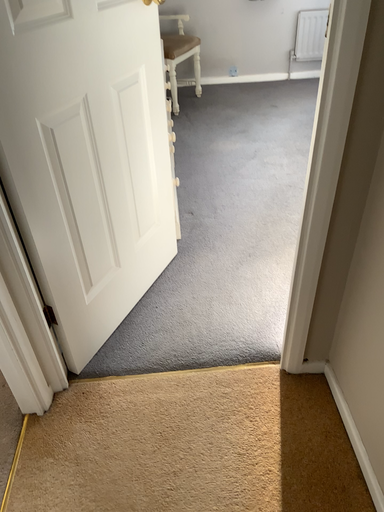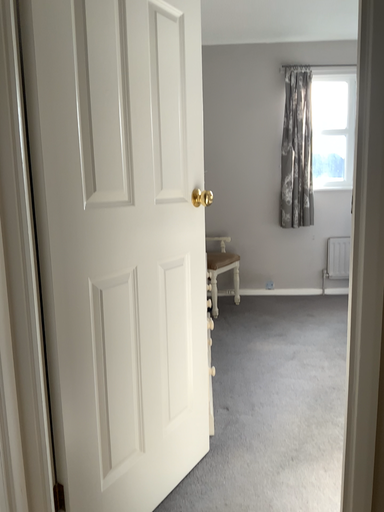
Question: How did the camera likely rotate when shooting the video?

Choices:
 (A) rotated upward
 (B) rotated downward

Answer: (A)